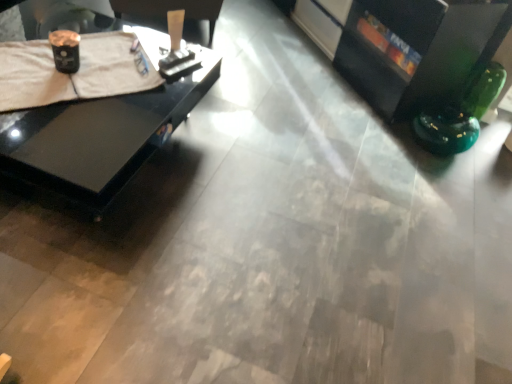
The height and width of the screenshot is (384, 512). Describe the element at coordinates (71, 74) in the screenshot. I see `white cloth at upper left` at that location.

Locate an element on the screen. black glossy entertainment center at upper right is located at coordinates (403, 46).

Describe the element at coordinates (98, 136) in the screenshot. Image resolution: width=512 pixels, height=384 pixels. I see `black glossy table at left` at that location.

At what (x,y) coordinates should I click in order to perform the action: click on white cloth at upper left. Please return your answer as a coordinate pair (x, y). Image resolution: width=512 pixels, height=384 pixels. Looking at the image, I should click on (71, 74).

Is point (357, 8) closer to viewer compared to point (22, 143)?

No, (357, 8) is behind (22, 143).

Which object is closer to the camera taking this photo, black glossy entertainment center at upper right or black glossy table at left?

black glossy table at left is more forward.

Is black glossy entertainment center at upper right outside of black glossy table at left?

Yes.

How different are the orientations of black glossy entertainment center at upper right and black glossy table at left in degrees?

The facing directions of black glossy entertainment center at upper right and black glossy table at left are 45.5 degrees apart.

Is black glossy table at left turned away from white cloth at upper left?

No, white cloth at upper left is not at the back of black glossy table at left.

Would you say white cloth at upper left is part of black glossy table at left's contents?

Yes, white cloth at upper left is a part of black glossy table at left.

Is there a large distance between black glossy table at left and white cloth at upper left?

They are positioned close to each other.

From a real-world perspective, is white cloth at upper left physically above black glossy table at left?

Yes, from a real-world perspective, white cloth at upper left is above black glossy table at left.

I want to click on blanket behind the black glossy table at left, so click(71, 74).

From the image's perspective, does white cloth at upper left appear lower than black glossy table at left?

Incorrect, from the image's perspective, white cloth at upper left is higher than black glossy table at left.

From the image's perspective, is black glossy table at left located beneath black glossy entertainment center at upper right?

Yes, from the image's perspective, black glossy table at left is beneath black glossy entertainment center at upper right.

Considering the sizes of black glossy table at left and black glossy entertainment center at upper right in the image, is black glossy table at left taller or shorter than black glossy entertainment center at upper right?

Considering their sizes, black glossy table at left has less height than black glossy entertainment center at upper right.

From a real-world perspective, which is physically below, black glossy table at left or black glossy entertainment center at upper right?

black glossy table at left is physically lower.

Is black glossy table at left far from black glossy entertainment center at upper right?

Yes, black glossy table at left and black glossy entertainment center at upper right are located far from each other.

Is white cloth at upper left wider than black glossy entertainment center at upper right?

No, white cloth at upper left is not wider than black glossy entertainment center at upper right.

Which object is further away from the camera, white cloth at upper left or black glossy entertainment center at upper right?

black glossy entertainment center at upper right is more distant.

From a real-world perspective, does white cloth at upper left sit lower than black glossy entertainment center at upper right?

Yes, from a real-world perspective, white cloth at upper left is below black glossy entertainment center at upper right.

Who is taller, black glossy entertainment center at upper right or white cloth at upper left?

black glossy entertainment center at upper right.

From the picture: Considering the sizes of objects black glossy entertainment center at upper right and white cloth at upper left in the image provided, who is thinner, black glossy entertainment center at upper right or white cloth at upper left?

white cloth at upper left is thinner.

Considering the positions of point (365, 29) and point (131, 40), is point (365, 29) closer or farther from the camera than point (131, 40)?

Point (365, 29) is farther from the camera than point (131, 40).

Locate an element on the screen. This screenshot has width=512, height=384. table that is below the black glossy entertainment center at upper right (from the image's perspective) is located at coordinates (98, 136).

Locate an element on the screen. The width and height of the screenshot is (512, 384). table on the left of white cloth at upper left is located at coordinates (98, 136).

When comparing their distances from white cloth at upper left, does black glossy entertainment center at upper right or black glossy table at left seem closer?

Based on the image, black glossy table at left appears to be nearer to white cloth at upper left.

From the image, which object appears to be nearer to black glossy table at left, black glossy entertainment center at upper right or white cloth at upper left?

white cloth at upper left is closer to black glossy table at left.

From the image, which object appears to be nearer to black glossy table at left, white cloth at upper left or black glossy entertainment center at upper right?

white cloth at upper left lies closer to black glossy table at left than the other object.

Which object lies further to the anchor point white cloth at upper left, black glossy table at left or black glossy entertainment center at upper right?

black glossy entertainment center at upper right is positioned further to the anchor white cloth at upper left.

From the image, which object appears to be nearer to black glossy entertainment center at upper right, white cloth at upper left or black glossy table at left?

black glossy table at left.

From the image, which object appears to be nearer to black glossy entertainment center at upper right, black glossy table at left or white cloth at upper left?

Based on the image, black glossy table at left appears to be nearer to black glossy entertainment center at upper right.

Find the location of a particular element. blanket between black glossy table at left and black glossy entertainment center at upper right is located at coordinates (71, 74).